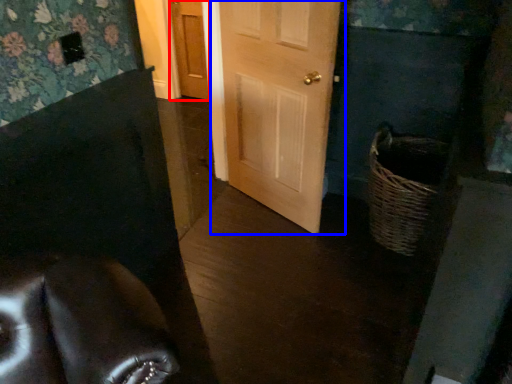
Question: Among these objects, which one is farthest to the camera, door (highlighted by a red box) or door (highlighted by a blue box)?

Choices:
 (A) door
 (B) door

Answer: (A)